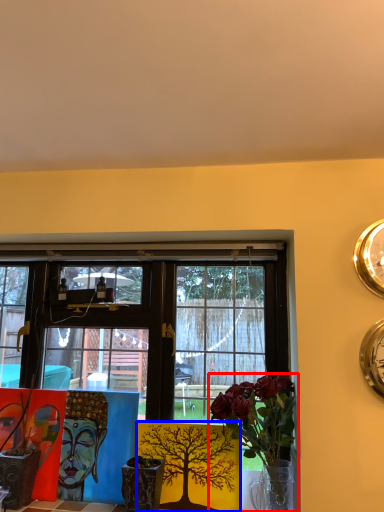
Question: Which point is further to the camera, houseplant (highlighted by a red box) or floral arrangement (highlighted by a blue box)?

Choices:
 (A) houseplant
 (B) floral arrangement

Answer: (B)